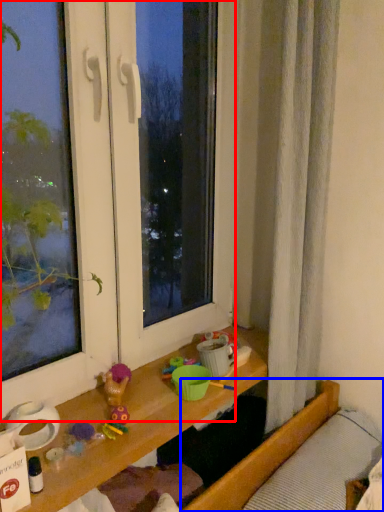
Question: Among these objects, which one is farthest to the camera, window (highlighted by a red box) or bed (highlighted by a blue box)?

Choices:
 (A) window
 (B) bed

Answer: (B)